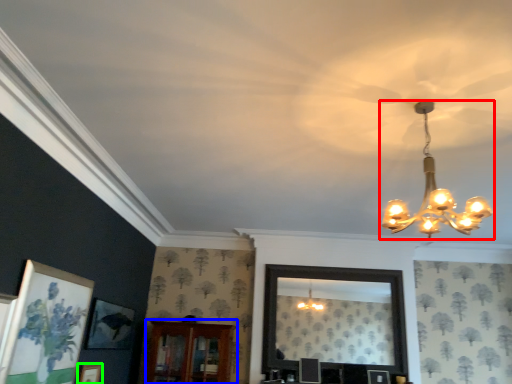
Question: Which is nearer to the lamp (highlighted by a red box)? furniture (highlighted by a blue box) or picture frame (highlighted by a green box).

Choices:
 (A) furniture
 (B) picture frame

Answer: (A)